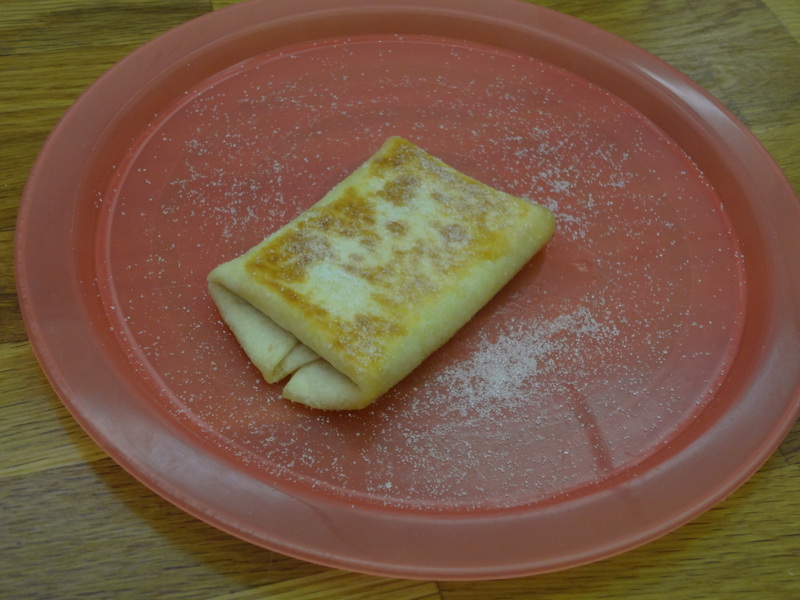
Find the location of a particular element. The image size is (800, 600). plate is located at coordinates (644, 413).